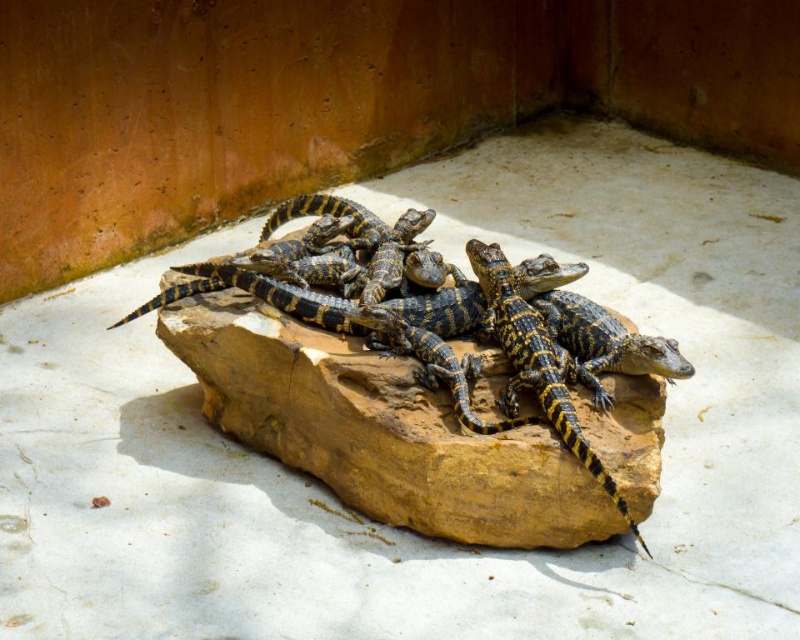
Question: Is yellow-black textured crocodile at center smaller than yellow-black scaly crocodile at center?

Choices:
 (A) no
 (B) yes

Answer: (A)

Question: Which point is closer to the camera taking this photo?

Choices:
 (A) (606, 492)
 (B) (406, 422)

Answer: (A)

Question: Is yellow-black textured crocodile at center positioned before yellow-black scaly crocodile at center?

Choices:
 (A) yes
 (B) no

Answer: (B)

Question: Can you confirm if yellow-black textured crocodile at center is bigger than yellow-black scaly crocodile at center?

Choices:
 (A) yes
 (B) no

Answer: (A)

Question: Which point appears closest to the camera in this image?

Choices:
 (A) (564, 371)
 (B) (566, 358)

Answer: (A)